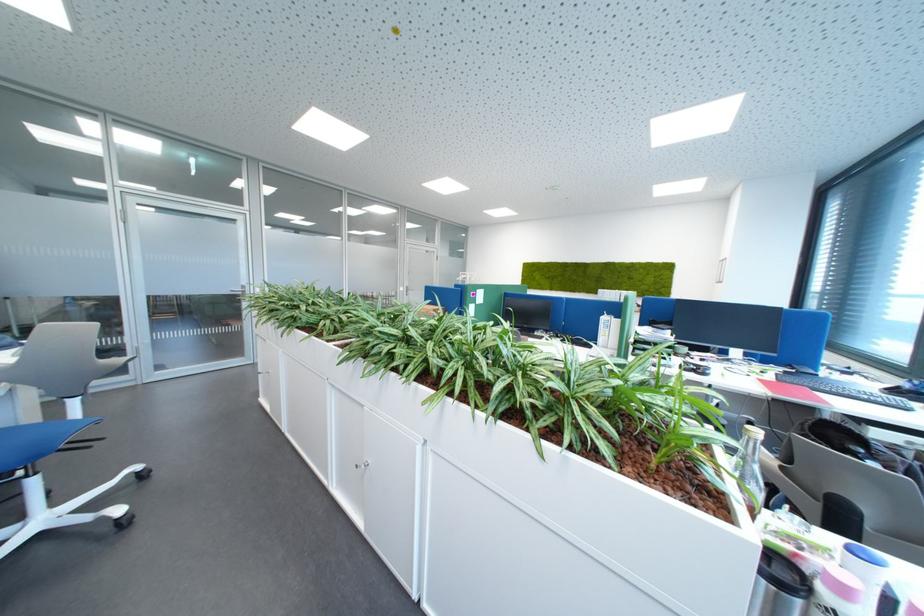
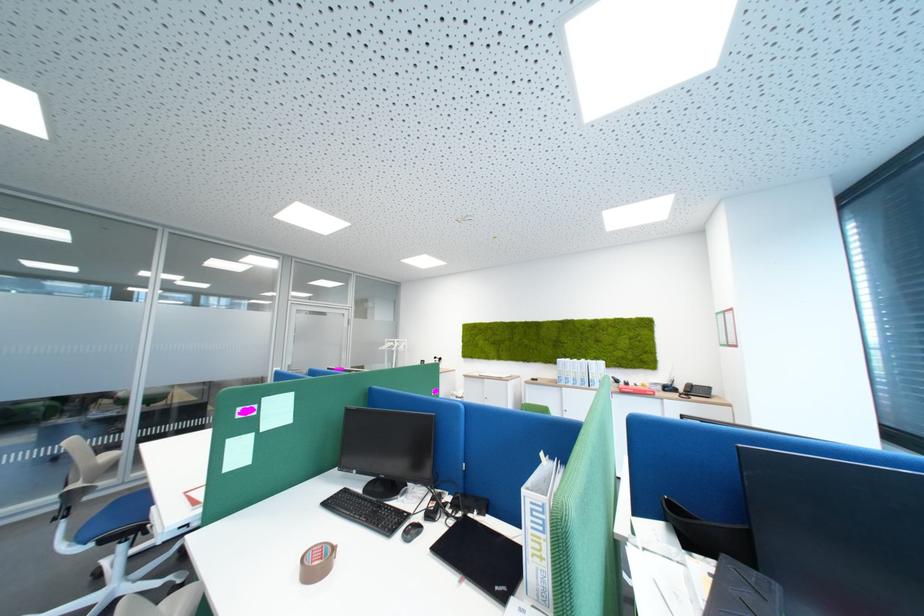
What movement of the cameraman would produce the second image?

The cameraman moved toward right, forward.